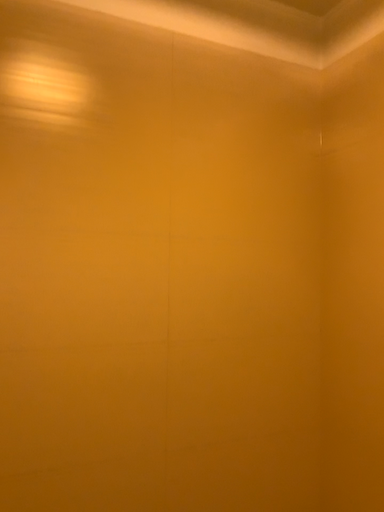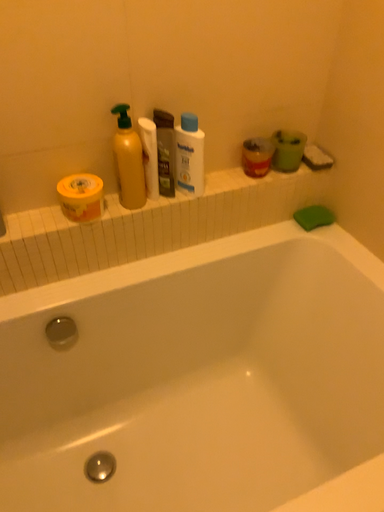
Question: How did the camera likely rotate when shooting the video?

Choices:
 (A) rotated upward
 (B) rotated downward

Answer: (B)